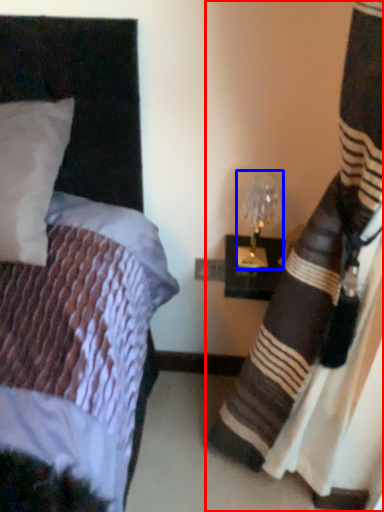
Question: Which point is closer to the camera, curtain (highlighted by a red box) or bedside lamp (highlighted by a blue box)?

Choices:
 (A) curtain
 (B) bedside lamp

Answer: (A)